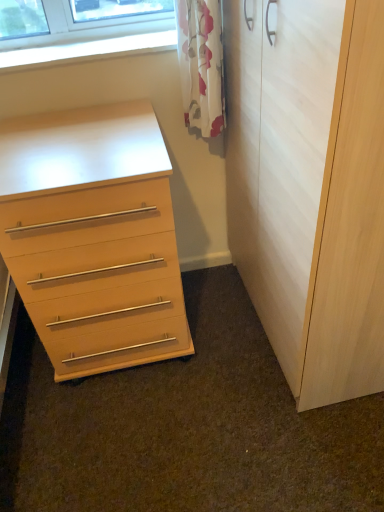
Measure the distance between light wood/texture cupboard at right and camera.

A distance of 64.96 centimeters exists between light wood/texture cupboard at right and camera.

This screenshot has height=512, width=384. Describe the element at coordinates (92, 42) in the screenshot. I see `clear glass window at upper left` at that location.

Identify the location of light wood/finish chest of drawers at left. (93, 237).

This screenshot has height=512, width=384. What do you see at coordinates (93, 237) in the screenshot?
I see `light wood/finish chest of drawers at left` at bounding box center [93, 237].

The image size is (384, 512). Find the location of `light wood/texture cupboard at right`. light wood/texture cupboard at right is located at coordinates (311, 189).

From the image's perspective, is light wood/finish chest of drawers at left over light wood/texture cupboard at right?

Incorrect, from the image's perspective, light wood/finish chest of drawers at left is lower than light wood/texture cupboard at right.

From the picture: Is light wood/finish chest of drawers at left wider than light wood/texture cupboard at right?

Indeed, light wood/finish chest of drawers at left has a greater width compared to light wood/texture cupboard at right.

How many degrees apart are the facing directions of light wood/finish chest of drawers at left and light wood/texture cupboard at right?

The angular difference between light wood/finish chest of drawers at left and light wood/texture cupboard at right is 88.4 degrees.

At what (x,y) coordinates should I click in order to perform the action: click on cupboard above the light wood/finish chest of drawers at left (from a real-world perspective). Please return your answer as a coordinate pair (x, y). The image size is (384, 512). Looking at the image, I should click on (311, 189).

How many degrees apart are the facing directions of light wood/finish chest of drawers at left and clear glass window at upper left?

They differ by 0.0897 degrees in their facing directions.

Is light wood/finish chest of drawers at left facing towards clear glass window at upper left?

No, light wood/finish chest of drawers at left is not turned towards clear glass window at upper left.

Is light wood/finish chest of drawers at left far away from clear glass window at upper left?

That's not correct — light wood/finish chest of drawers at left is a little close to clear glass window at upper left.

How many degrees apart are the facing directions of clear glass window at upper left and light wood/texture cupboard at right?

They differ by 88.5 degrees in their facing directions.

Based on the photo, considering the positions of objects clear glass window at upper left and light wood/texture cupboard at right in the image provided, who is more to the right, clear glass window at upper left or light wood/texture cupboard at right?

Positioned to the right is light wood/texture cupboard at right.

Considering the sizes of objects clear glass window at upper left and light wood/texture cupboard at right in the image provided, who is bigger, clear glass window at upper left or light wood/texture cupboard at right?

light wood/texture cupboard at right is bigger.

In the scene shown: Between clear glass window at upper left and light wood/finish chest of drawers at left, which one appears on the left side from the viewer's perspective?

From the viewer's perspective, clear glass window at upper left appears more on the left side.

Is clear glass window at upper left taller than light wood/finish chest of drawers at left?

No, clear glass window at upper left is not taller than light wood/finish chest of drawers at left.

Can you tell me how much clear glass window at upper left and light wood/finish chest of drawers at left differ in facing direction?

There is a 0.0897-degree angle between the facing directions of clear glass window at upper left and light wood/finish chest of drawers at left.

From the picture: Can we say clear glass window at upper left lies outside light wood/finish chest of drawers at left?

Absolutely, clear glass window at upper left is external to light wood/finish chest of drawers at left.

Is light wood/finish chest of drawers at left inside white floral curtain at upper center?

No, light wood/finish chest of drawers at left is located outside of white floral curtain at upper center.

Is white floral curtain at upper center positioned behind light wood/finish chest of drawers at left?

Yes, it is behind light wood/finish chest of drawers at left.

Is white floral curtain at upper center bigger or smaller than light wood/finish chest of drawers at left?

Clearly, white floral curtain at upper center is smaller in size than light wood/finish chest of drawers at left.

Is white floral curtain at upper center touching light wood/finish chest of drawers at left?

white floral curtain at upper center is not next to light wood/finish chest of drawers at left, and they're not touching.

Is white floral curtain at upper center outside of clear glass window at upper left?

Indeed, white floral curtain at upper center is completely outside clear glass window at upper left.

From a real-world perspective, relative to clear glass window at upper left, is white floral curtain at upper center vertically above or below?

white floral curtain at upper center is below clear glass window at upper left.

In terms of width, does white floral curtain at upper center look wider or thinner when compared to clear glass window at upper left?

white floral curtain at upper center is thinner than clear glass window at upper left.

How far apart are white floral curtain at upper center and clear glass window at upper left?

A distance of 9.47 inches exists between white floral curtain at upper center and clear glass window at upper left.

Can we say light wood/texture cupboard at right lies outside light wood/finish chest of drawers at left?

Indeed, light wood/texture cupboard at right is completely outside light wood/finish chest of drawers at left.

Based on the photo, from the image's perspective, which is above, light wood/texture cupboard at right or light wood/finish chest of drawers at left?

light wood/texture cupboard at right appears higher in the image.

Does light wood/texture cupboard at right have a lesser width compared to light wood/finish chest of drawers at left?

Yes, light wood/texture cupboard at right is thinner than light wood/finish chest of drawers at left.

Is the depth of light wood/texture cupboard at right less than that of light wood/finish chest of drawers at left?

Yes, it is.

At what (x,y) coordinates should I click in order to perform the action: click on cupboard in front of the light wood/finish chest of drawers at left. Please return your answer as a coordinate pair (x, y). Looking at the image, I should click on (311, 189).

Find the location of a particular element. window on the left of light wood/finish chest of drawers at left is located at coordinates (92, 42).

When comparing their distances from clear glass window at upper left, does light wood/texture cupboard at right or white floral curtain at upper center seem closer?

The object closer to clear glass window at upper left is white floral curtain at upper center.

Based on their spatial positions, is light wood/finish chest of drawers at left or white floral curtain at upper center closer to clear glass window at upper left?

Among the two, white floral curtain at upper center is located nearer to clear glass window at upper left.

Based on their spatial positions, is clear glass window at upper left or white floral curtain at upper center further from light wood/finish chest of drawers at left?

clear glass window at upper left.

Estimate the real-world distances between objects in this image. Which object is closer to light wood/texture cupboard at right, white floral curtain at upper center or light wood/finish chest of drawers at left?

white floral curtain at upper center.

From the image, which object appears to be farther from light wood/finish chest of drawers at left, white floral curtain at upper center or clear glass window at upper left?

Based on the image, clear glass window at upper left appears to be further to light wood/finish chest of drawers at left.

Which object lies further to the anchor point light wood/finish chest of drawers at left, white floral curtain at upper center or light wood/texture cupboard at right?

Among the two, white floral curtain at upper center is located further to light wood/finish chest of drawers at left.

From the image, which object appears to be nearer to white floral curtain at upper center, light wood/finish chest of drawers at left or clear glass window at upper left?

Based on the image, clear glass window at upper left appears to be nearer to white floral curtain at upper center.

Which object lies further to the anchor point light wood/texture cupboard at right, clear glass window at upper left or white floral curtain at upper center?

Among the two, clear glass window at upper left is located further to light wood/texture cupboard at right.

Find the location of a particular element. curtain between clear glass window at upper left and light wood/finish chest of drawers at left from top to bottom is located at coordinates (201, 64).

Find the location of a particular element. Image resolution: width=384 pixels, height=512 pixels. chest of drawers between clear glass window at upper left and light wood/texture cupboard at right from left to right is located at coordinates (93, 237).

You are a GUI agent. You are given a task and a screenshot of the screen. Output one action in this format:
    pyautogui.click(x=<x>, y=<y>)
    Task: Click on the curtain situated between light wood/finish chest of drawers at left and light wood/texture cupboard at right from left to right
    The image size is (384, 512).
    Given the screenshot: What is the action you would take?
    pyautogui.click(x=201, y=64)

Find the location of a particular element. curtain between clear glass window at upper left and light wood/texture cupboard at right in the horizontal direction is located at coordinates (201, 64).